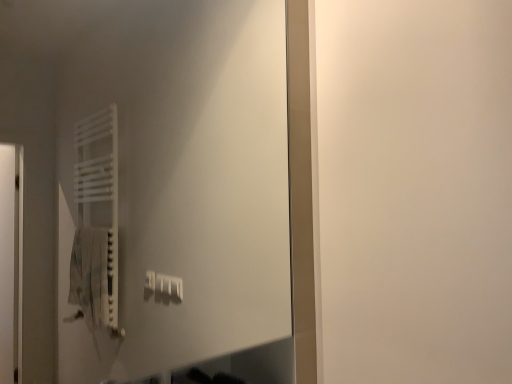
Locate an element on the screen. white plastic radiator at left is located at coordinates (173, 186).

What do you see at coordinates (173, 186) in the screenshot? This screenshot has width=512, height=384. I see `white plastic radiator at left` at bounding box center [173, 186].

Identify the location of white plastic radiator at left. (173, 186).